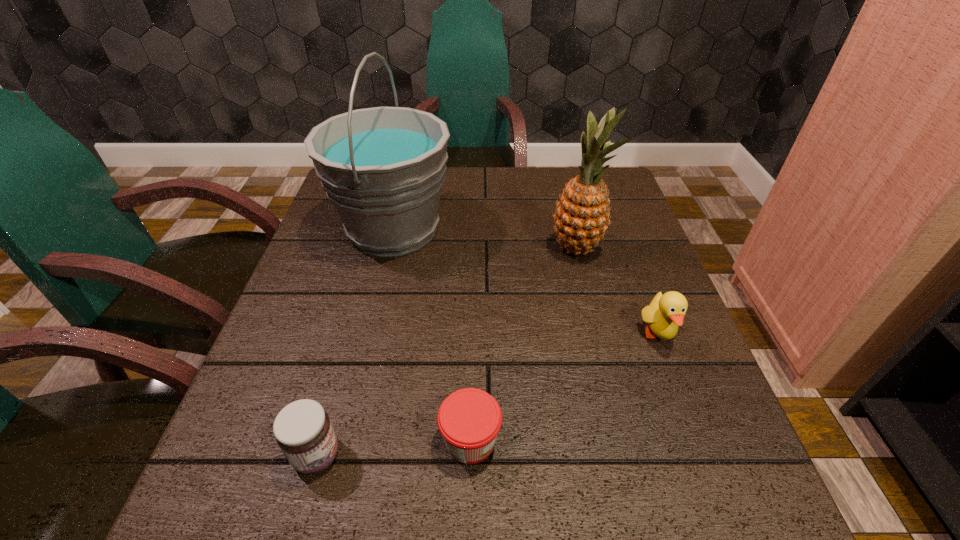
Where is `vacant space positioned on the front-facing side of the rightmost object`? Image resolution: width=960 pixels, height=540 pixels. vacant space positioned on the front-facing side of the rightmost object is located at coordinates (681, 394).

In order to click on free spot located 0.160m on the front label of the left jam in this screenshot , I will do `click(444, 455)`.

Where is `blank area located 0.170m on the label side of the shortest object`? The height and width of the screenshot is (540, 960). blank area located 0.170m on the label side of the shortest object is located at coordinates (607, 440).

Find the location of a particular element. object located in the far edge section of the desktop is located at coordinates (383, 168).

Where is `object that is positioned at the near edge`? object that is positioned at the near edge is located at coordinates (303, 431).

Where is `bucket that is at the left edge`? bucket that is at the left edge is located at coordinates (383, 168).

You are a GUI agent. You are given a task and a screenshot of the screen. Output one action in this format:
    pyautogui.click(x=<x>, y=<y>)
    Task: Click on the jam positioned at the left edge
    
    Given the screenshot: What is the action you would take?
    pyautogui.click(x=303, y=431)

Find the location of a particular element. The height and width of the screenshot is (540, 960). pineapple that is at the right edge is located at coordinates (583, 214).

Where is `duckling situated at the right edge`? duckling situated at the right edge is located at coordinates (666, 312).

This screenshot has height=540, width=960. I want to click on object that is at the far left corner, so click(383, 168).